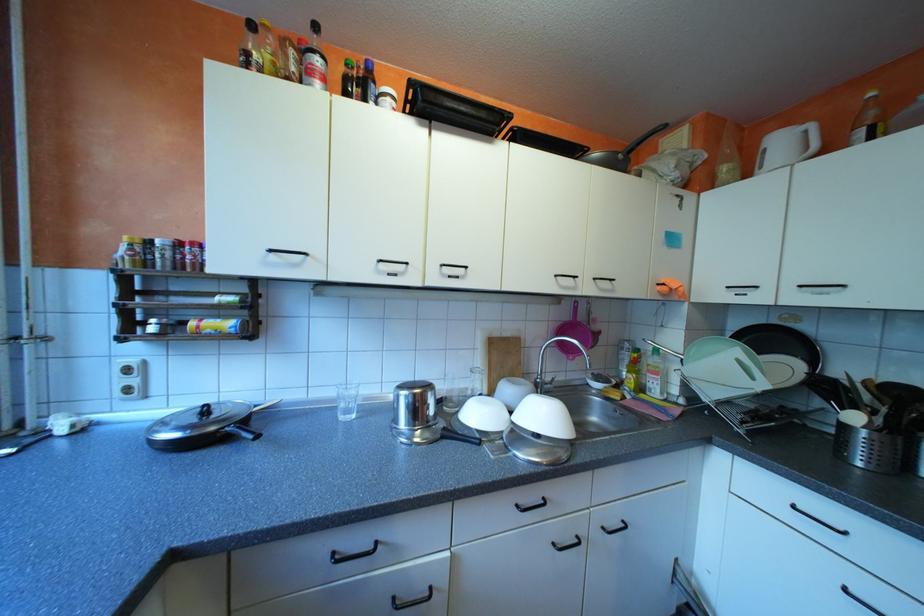
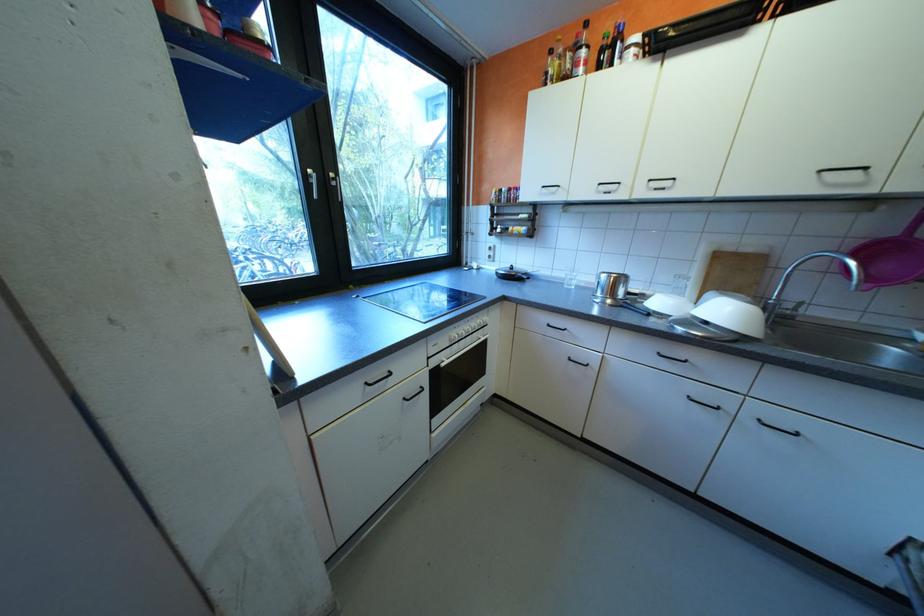
Locate, in the second image, the point that corresponds to [609,532] in the first image.

(760, 419)